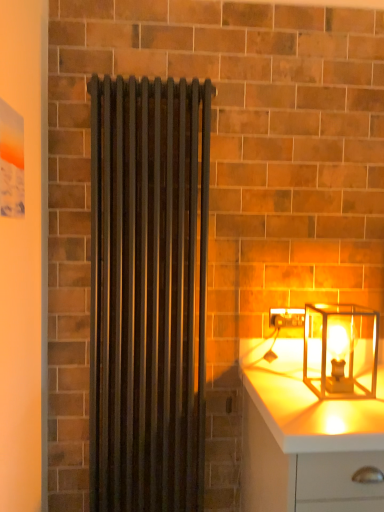
Find the location of a particular element. The image size is (384, 512). free region on the left part of translucent glass lantern at right is located at coordinates (294, 394).